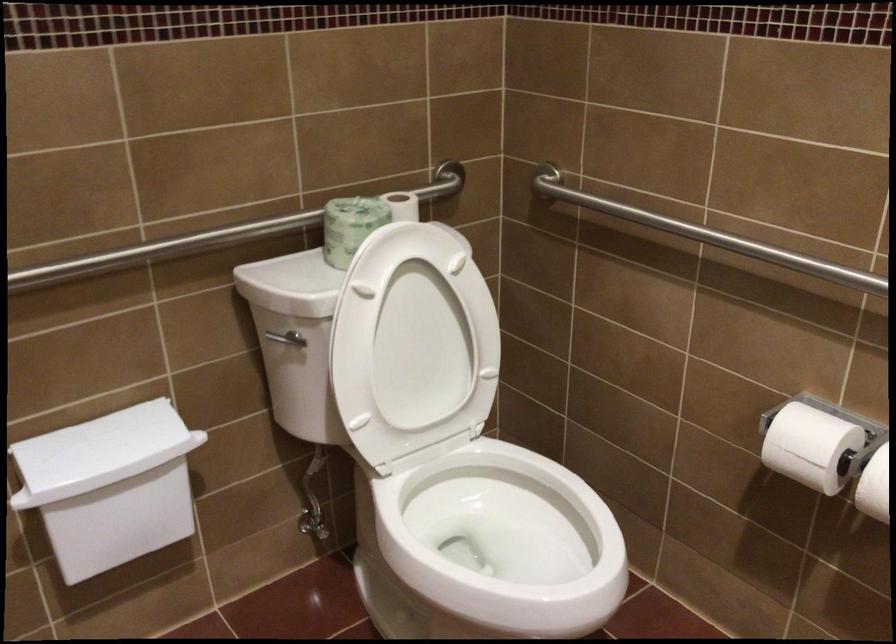
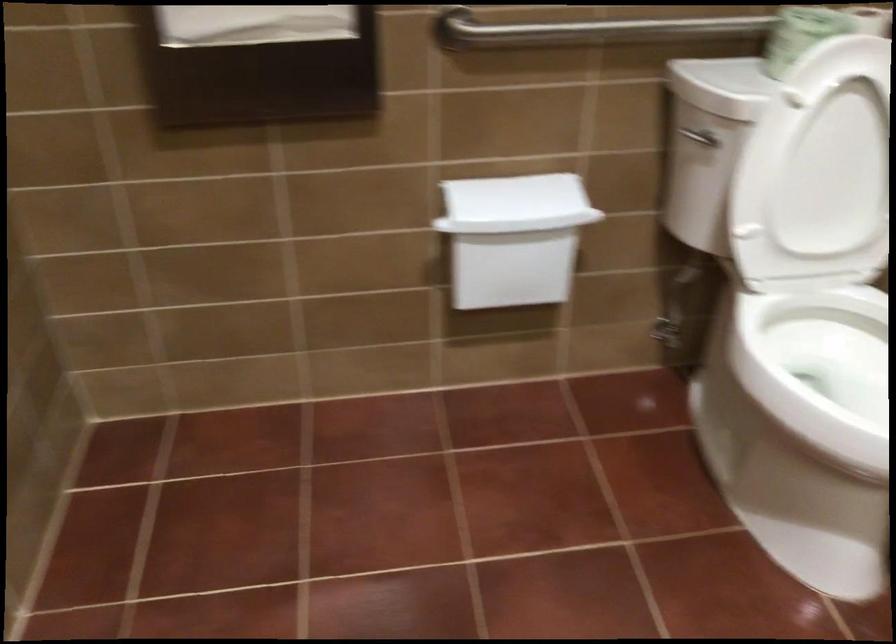
The point at (x=125, y=526) is marked in the first image. Where is the corresponding point in the second image?

(512, 269)